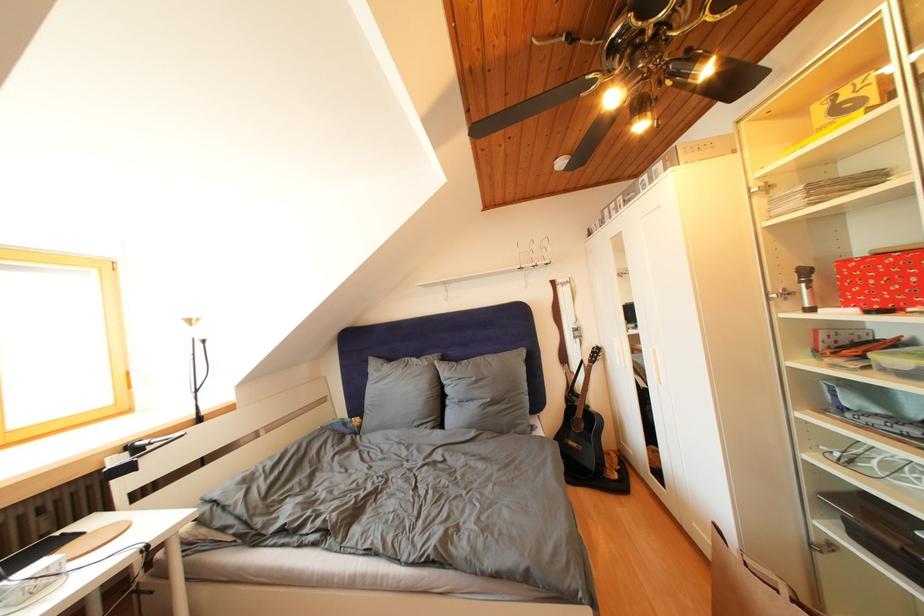
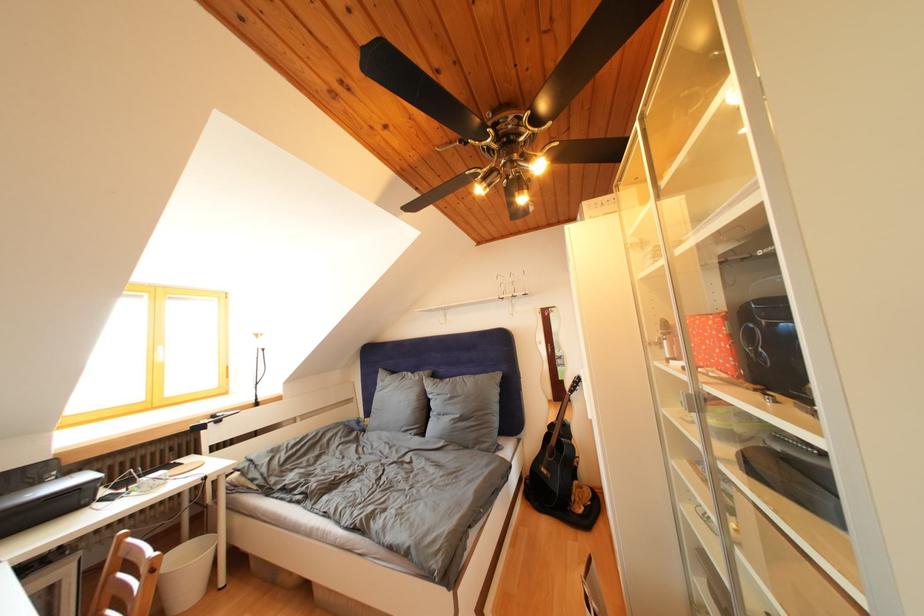
Locate, in the second image, the point that corresponds to pixel 397 365 in the first image.

(400, 378)